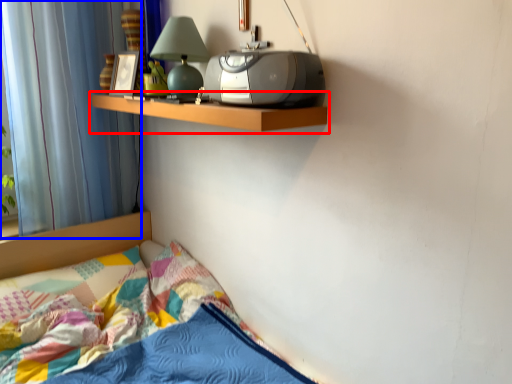
Question: Which object is further to the camera taking this photo, shelf (highlighted by a red box) or curtain (highlighted by a blue box)?

Choices:
 (A) shelf
 (B) curtain

Answer: (B)